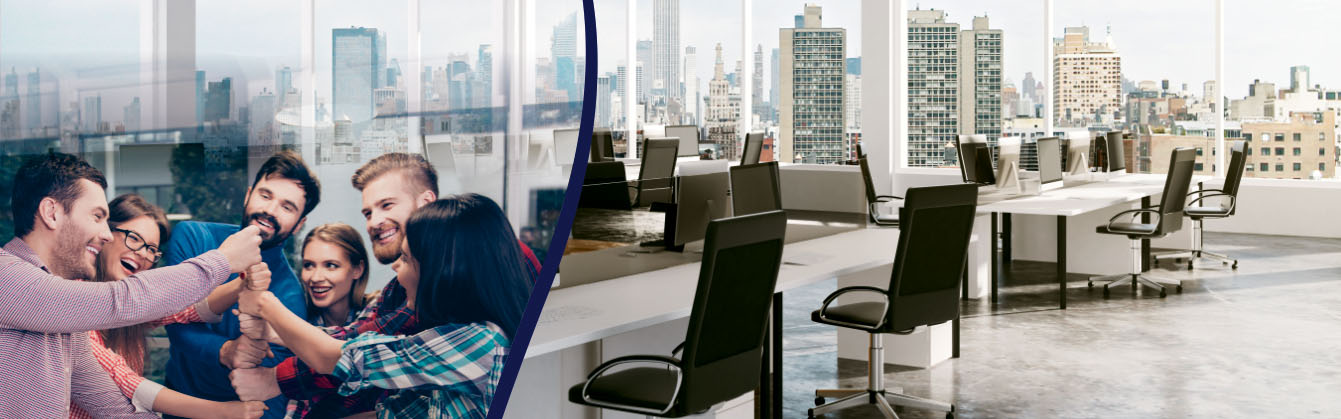
Where is `chairs`? This screenshot has width=1341, height=419. chairs is located at coordinates (721, 350), (912, 294), (1169, 202), (1242, 182), (869, 183), (751, 145), (653, 165), (966, 152).